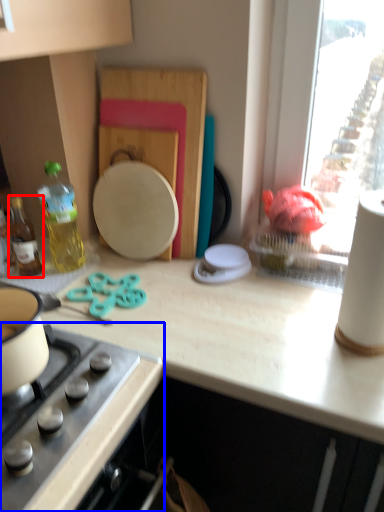
Question: Which of the following is the farthest to the observer, bottle (highlighted by a red box) or gas stove (highlighted by a blue box)?

Choices:
 (A) bottle
 (B) gas stove

Answer: (A)